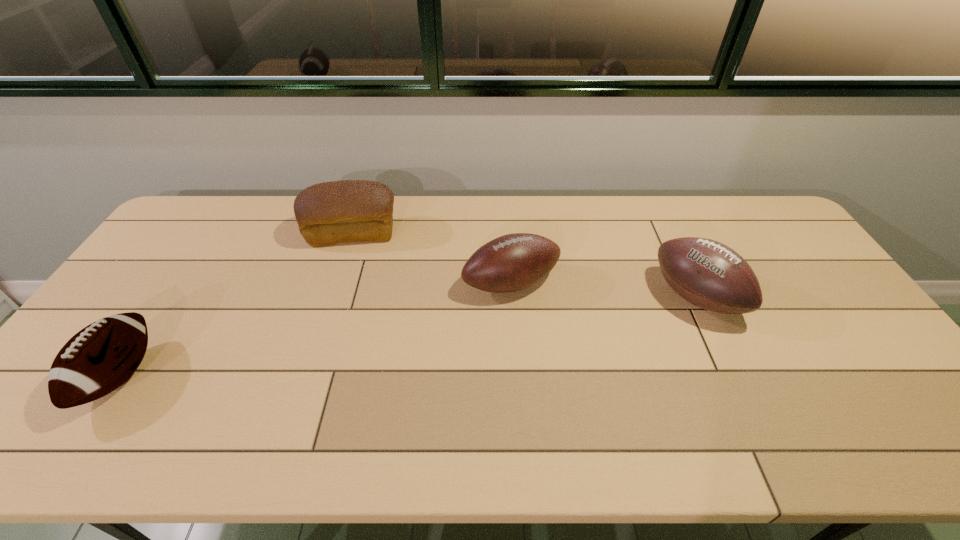
Image resolution: width=960 pixels, height=540 pixels. Find the location of `the rightmost football (American)`. the rightmost football (American) is located at coordinates (708, 274).

This screenshot has width=960, height=540. In order to click on bread in this screenshot , I will do [x=329, y=213].

Identify the location of the farthest object. Image resolution: width=960 pixels, height=540 pixels. (329, 213).

Where is `the second football (American) from left to right`? the second football (American) from left to right is located at coordinates (513, 262).

The width and height of the screenshot is (960, 540). Identify the location of the nearest football (American). (101, 357).

Locate an element on the screen. the nearest object is located at coordinates (101, 357).

This screenshot has height=540, width=960. Identify the location of vacant space situated 0.080m on the front of the rightmost football (American). [x=722, y=356].

You are a GUI agent. You are given a task and a screenshot of the screen. Output one action in this format:
    pyautogui.click(x=<x>, y=<y>)
    Task: Click on the vacant space located 0.080m on the front of the farthest object
    The width and height of the screenshot is (960, 540).
    Given the screenshot: What is the action you would take?
    pyautogui.click(x=342, y=268)

Identify the location of vacant space located on the left of the second football (American) from left to right. This screenshot has height=540, width=960. (342, 283).

The height and width of the screenshot is (540, 960). I want to click on vacant space situated 0.290m on the back of the nearest object, so click(197, 261).